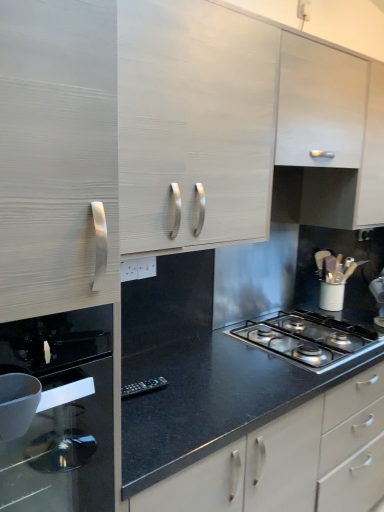
Question: Is black glass oven at left behind polished stainless steel gas stove at center?

Choices:
 (A) yes
 (B) no

Answer: (B)

Question: Does black glass oven at left turn towards polished stainless steel gas stove at center?

Choices:
 (A) no
 (B) yes

Answer: (A)

Question: Considering the relative positions of black glass oven at left and polished stainless steel gas stove at center in the image provided, is black glass oven at left to the right of polished stainless steel gas stove at center from the viewer's perspective?

Choices:
 (A) no
 (B) yes

Answer: (A)

Question: Is black glass oven at left far from polished stainless steel gas stove at center?

Choices:
 (A) no
 (B) yes

Answer: (B)

Question: Considering the relative sizes of black glass oven at left and polished stainless steel gas stove at center in the image provided, is black glass oven at left shorter than polished stainless steel gas stove at center?

Choices:
 (A) no
 (B) yes

Answer: (A)

Question: From the image's perspective, relative to white wood cabinet at upper center, the second cabinetry from the left, is matte white cabinet at upper left, which ranks as the second cabinetry in right-to-left order, above or below?

Choices:
 (A) below
 (B) above

Answer: (A)

Question: From a real-world perspective, is matte white cabinet at upper left, which ranks as the second cabinetry in right-to-left order, positioned above or below white wood cabinet at upper center, the 1th cabinetry in the right-to-left sequence?

Choices:
 (A) above
 (B) below

Answer: (B)

Question: Based on their sizes in the image, would you say matte white cabinet at upper left, which ranks as the first cabinetry in left-to-right order, is bigger or smaller than white wood cabinet at upper center, the second cabinetry from the left?

Choices:
 (A) small
 (B) big

Answer: (B)

Question: Is matte white cabinet at upper left, which ranks as the second cabinetry in right-to-left order, inside or outside of white wood cabinet at upper center, the 1th cabinetry in the right-to-left sequence?

Choices:
 (A) inside
 (B) outside

Answer: (B)

Question: In terms of width, does polished stainless steel gas stove at center look wider or thinner when compared to black glass oven at left?

Choices:
 (A) wide
 (B) thin

Answer: (B)

Question: Considering the positions of polished stainless steel gas stove at center and black glass oven at left in the image, is polished stainless steel gas stove at center bigger or smaller than black glass oven at left?

Choices:
 (A) big
 (B) small

Answer: (B)

Question: Considering the positions of point (327, 346) and point (74, 379), is point (327, 346) closer or farther from the camera than point (74, 379)?

Choices:
 (A) closer
 (B) farther

Answer: (B)

Question: Is polished stainless steel gas stove at center in front of or behind black glass oven at left in the image?

Choices:
 (A) front
 (B) behind

Answer: (B)

Question: In the image, is matte white cabinet at upper left, which ranks as the second cabinetry in right-to-left order, positioned in front of or behind polished stainless steel gas stove at center?

Choices:
 (A) behind
 (B) front

Answer: (B)

Question: Is matte white cabinet at upper left, which ranks as the first cabinetry in left-to-right order, inside or outside of polished stainless steel gas stove at center?

Choices:
 (A) inside
 (B) outside

Answer: (B)